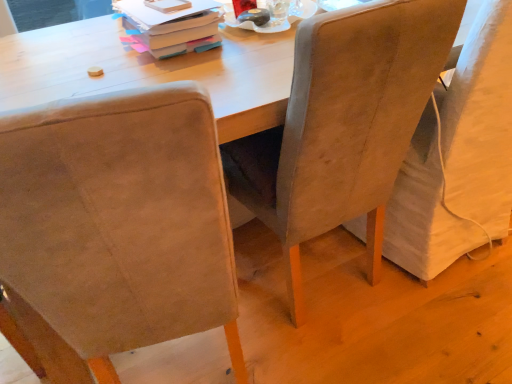
Question: Does suede-like beige chair at left, placed as the 3th chair when sorted from right to left, have a larger size compared to suede-like beige chair at center, acting as the 2th chair starting from the left?

Choices:
 (A) no
 (B) yes

Answer: (B)

Question: From the image's perspective, does suede-like beige chair at left, placed as the 3th chair when sorted from right to left, appear higher than suede-like beige chair at center, which is the second chair from right to left?

Choices:
 (A) yes
 (B) no

Answer: (B)

Question: Is suede-like beige chair at left, placed as the 3th chair when sorted from right to left, positioned with its back to suede-like beige chair at center, acting as the 2th chair starting from the left?

Choices:
 (A) yes
 (B) no

Answer: (B)

Question: Considering the relative sizes of suede-like beige chair at left, the first chair viewed from the left, and suede-like beige chair at center, which is the second chair from right to left, in the image provided, is suede-like beige chair at left, the first chair viewed from the left, shorter than suede-like beige chair at center, which is the second chair from right to left,?

Choices:
 (A) no
 (B) yes

Answer: (B)

Question: From a real-world perspective, is suede-like beige chair at left, the first chair viewed from the left, located beneath suede-like beige chair at center, which is the second chair from right to left?

Choices:
 (A) yes
 (B) no

Answer: (A)

Question: Is suede-like beige chair at left, the first chair viewed from the left, with suede-like beige chair at center, acting as the 2th chair starting from the left?

Choices:
 (A) yes
 (B) no

Answer: (B)

Question: Is matte cardboard book at upper center to the left of suede-like beige chair at right, which is the 1th chair from right to left, from the viewer's perspective?

Choices:
 (A) no
 (B) yes

Answer: (B)

Question: Is matte cardboard book at upper center facing away from suede-like beige chair at right, which ranks as the third chair in left-to-right order?

Choices:
 (A) no
 (B) yes

Answer: (A)

Question: Could you tell me if matte cardboard book at upper center is facing suede-like beige chair at right, which ranks as the third chair in left-to-right order?

Choices:
 (A) yes
 (B) no

Answer: (B)

Question: Can you confirm if matte cardboard book at upper center is shorter than suede-like beige chair at right, which is the 1th chair from right to left?

Choices:
 (A) yes
 (B) no

Answer: (A)

Question: Are matte cardboard book at upper center and suede-like beige chair at right, which ranks as the third chair in left-to-right order, beside each other?

Choices:
 (A) yes
 (B) no

Answer: (B)

Question: From the image's perspective, does matte cardboard book at upper center appear higher than suede-like beige chair at right, which is the 1th chair from right to left?

Choices:
 (A) no
 (B) yes

Answer: (B)

Question: Does matte cardboard book at upper center lie in front of suede-like beige chair at left, the first chair viewed from the left?

Choices:
 (A) no
 (B) yes

Answer: (A)